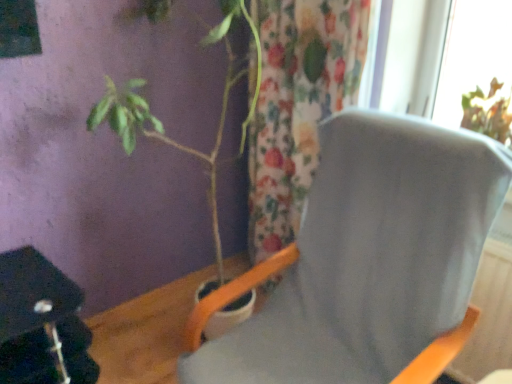
Question: Is gray fabric chair at center inside or outside of floral fabric curtain at center?

Choices:
 (A) inside
 (B) outside

Answer: (B)

Question: In terms of width, does gray fabric chair at center look wider or thinner when compared to floral fabric curtain at center?

Choices:
 (A) wide
 (B) thin

Answer: (A)

Question: Considering the real-world distances, which object is closest to the gray fabric chair at center?

Choices:
 (A) floral fabric curtain at center
 (B) green matte plant at left

Answer: (B)

Question: Which of these objects is positioned closest to the floral fabric curtain at center?

Choices:
 (A) green matte plant at left
 (B) gray fabric chair at center

Answer: (A)